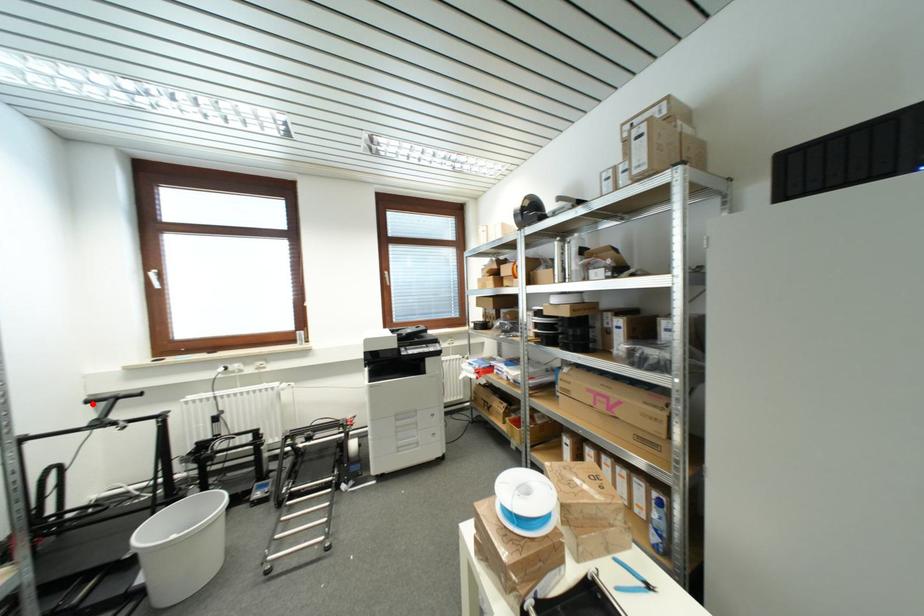
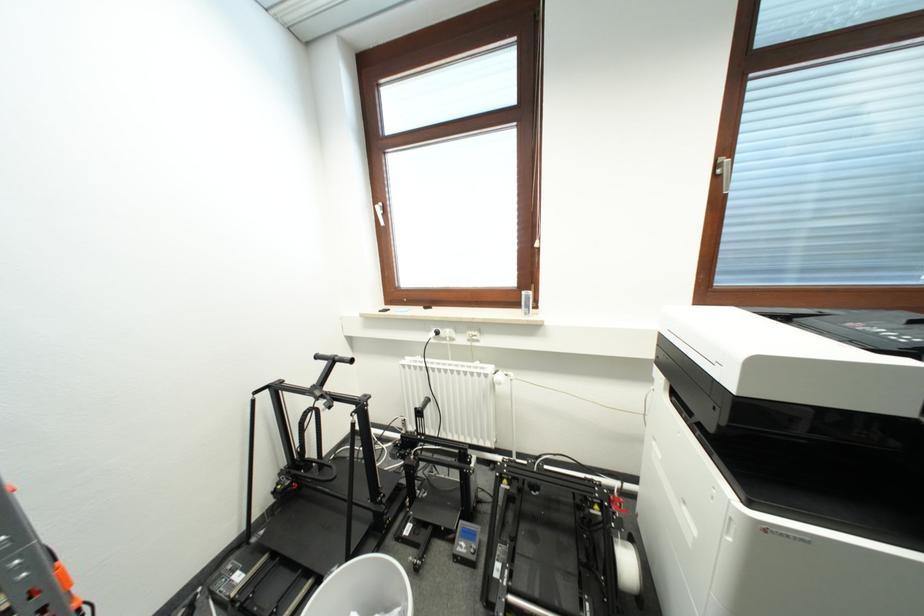
Question: I am providing you with two images of the same scene from different viewpoints. In image1, a red point is highlighted. Considering the same 3D point in image2, which of the following is correct?

Choices:
 (A) It is closer
 (B) It is farther

Answer: (A)